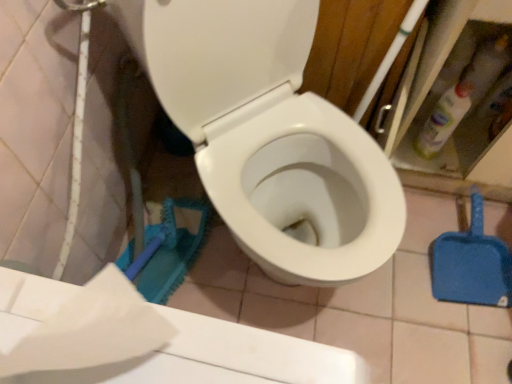
Question: Is white matte toilet paper at lower left not close to white glossy toilet at center?

Choices:
 (A) no
 (B) yes

Answer: (A)

Question: Is white matte toilet paper at lower left thinner than white glossy toilet at center?

Choices:
 (A) yes
 (B) no

Answer: (A)

Question: From the image's perspective, is white matte toilet paper at lower left on white glossy toilet at center?

Choices:
 (A) no
 (B) yes

Answer: (A)

Question: Can you confirm if white matte toilet paper at lower left is shorter than white glossy toilet at center?

Choices:
 (A) no
 (B) yes

Answer: (B)

Question: Can you confirm if white matte toilet paper at lower left is positioned to the right of white glossy toilet at center?

Choices:
 (A) yes
 (B) no

Answer: (B)

Question: Is white matte toilet paper at lower left looking in the opposite direction of white glossy toilet at center?

Choices:
 (A) yes
 (B) no

Answer: (B)

Question: Considering the relative sizes of white matte toilet paper at lower left and blue plastic shovel at lower right in the image provided, is white matte toilet paper at lower left wider than blue plastic shovel at lower right?

Choices:
 (A) yes
 (B) no

Answer: (B)

Question: Can you confirm if white matte toilet paper at lower left is positioned to the right of blue plastic shovel at lower right?

Choices:
 (A) no
 (B) yes

Answer: (A)

Question: From a real-world perspective, is white matte toilet paper at lower left beneath blue plastic shovel at lower right?

Choices:
 (A) yes
 (B) no

Answer: (B)

Question: Is the position of white matte toilet paper at lower left more distant than that of blue plastic shovel at lower right?

Choices:
 (A) yes
 (B) no

Answer: (B)

Question: Is white matte toilet paper at lower left closer to the viewer compared to blue plastic shovel at lower right?

Choices:
 (A) yes
 (B) no

Answer: (A)

Question: Is white matte toilet paper at lower left bigger than blue plastic shovel at lower right?

Choices:
 (A) yes
 (B) no

Answer: (B)

Question: Does white glossy toilet at center appear on the left side of blue plastic shovel at lower right?

Choices:
 (A) no
 (B) yes

Answer: (B)